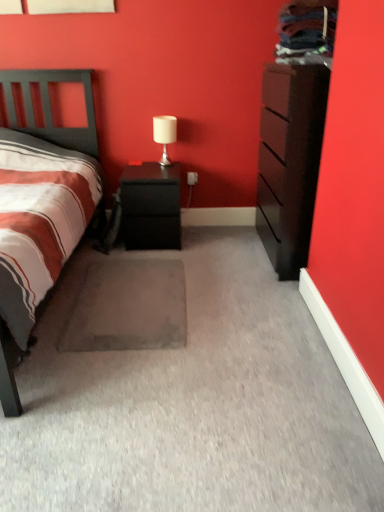
What are the coordinates of `free space on the front side of black matte nightstand at center` in the screenshot? It's located at (149, 262).